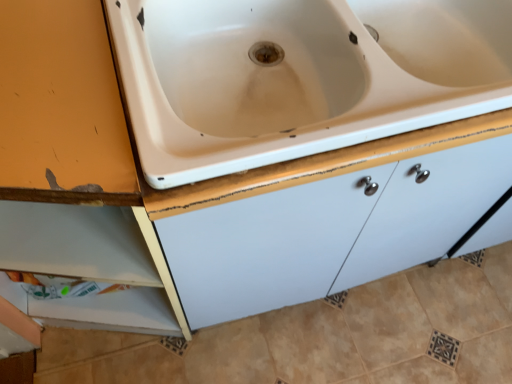
The width and height of the screenshot is (512, 384). What do you see at coordinates (298, 76) in the screenshot? I see `beige plastic sink at center` at bounding box center [298, 76].

Locate an element on the screen. This screenshot has height=384, width=512. beige plastic sink at center is located at coordinates (298, 76).

Image resolution: width=512 pixels, height=384 pixels. Find the location of `beige plastic sink at center`. beige plastic sink at center is located at coordinates (298, 76).